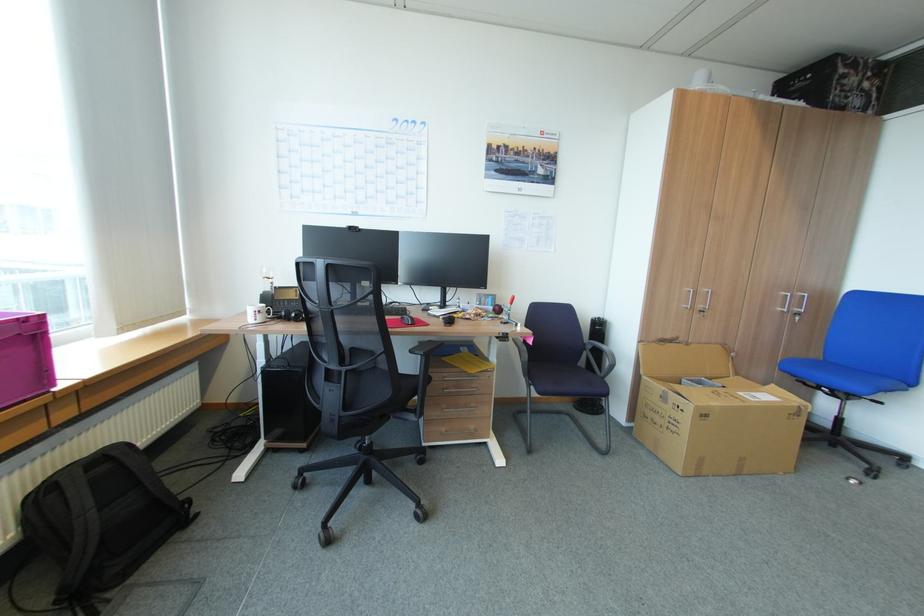
Where would you sit the blue chair sitting surface? Please return your answer as a coordinate pair (x, y).

(833, 374)